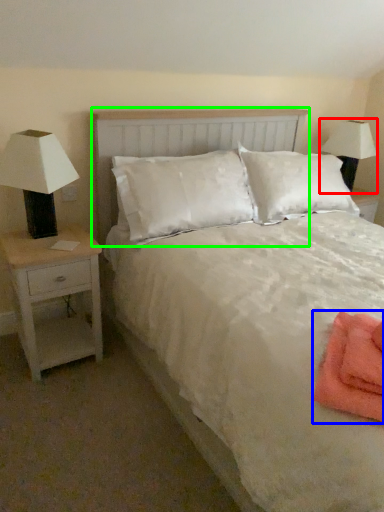
Question: Which is nearer to the lamp (highlighted by a red box)? material (highlighted by a blue box) or headboard (highlighted by a green box).

Choices:
 (A) material
 (B) headboard

Answer: (B)